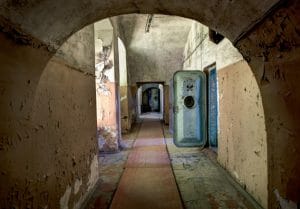
Locate an element on the screen. paint is located at coordinates click(x=148, y=180), click(x=107, y=110), click(x=42, y=125), click(x=237, y=120), click(x=133, y=107), click(x=125, y=107), click(x=166, y=102).